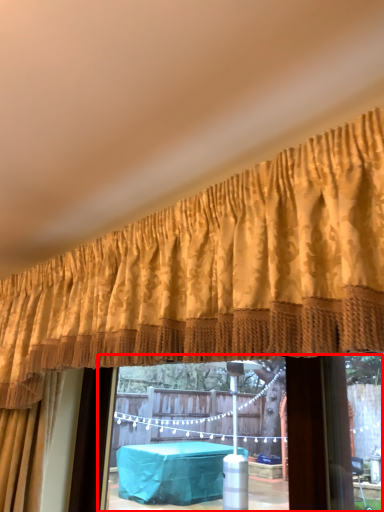
Question: Observing the image, what is the correct spatial positioning of window frame (annotated by the red box) in reference to curtain?

Choices:
 (A) left
 (B) right

Answer: (B)